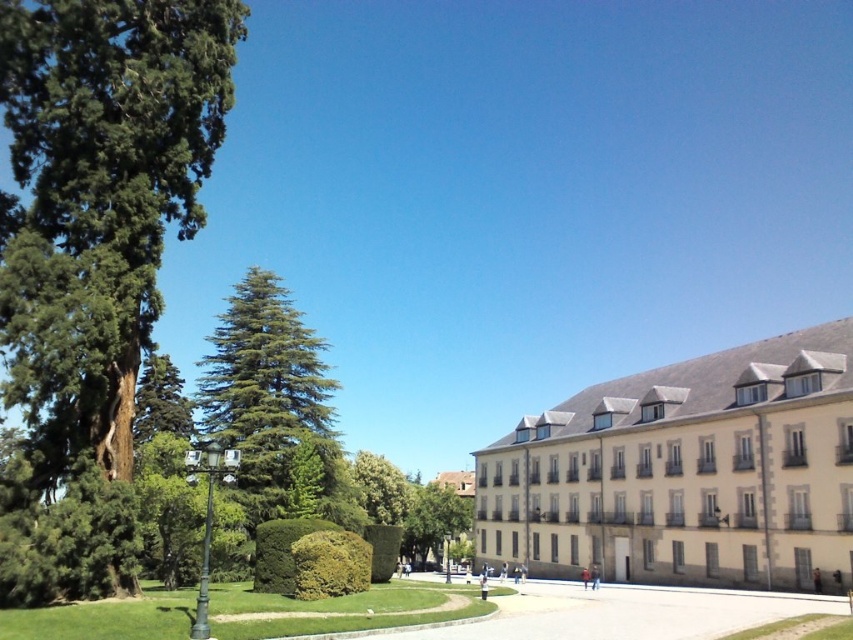
Question: Estimate the real-world distances between objects in this image. Which object is closer to the green needle-like tree at center?

Choices:
 (A) green textured tree at left
 (B) green leafy tree at center

Answer: (B)

Question: Can you confirm if green needle-like tree at center is positioned below green leafy hedge at center?

Choices:
 (A) no
 (B) yes

Answer: (A)

Question: Is green textured tree at left bigger than beige stone building at center-right?

Choices:
 (A) no
 (B) yes

Answer: (B)

Question: Among these objects, which one is nearest to the camera?

Choices:
 (A) green needle-like tree at center
 (B) green textured tree at left

Answer: (B)

Question: Among these objects, which one is nearest to the camera?

Choices:
 (A) green needle-like tree at center
 (B) green leafy hedge at center

Answer: (B)

Question: Observing the image, what is the correct spatial positioning of beige stone building at center-right in reference to green needle-like tree at center?

Choices:
 (A) left
 (B) right

Answer: (B)